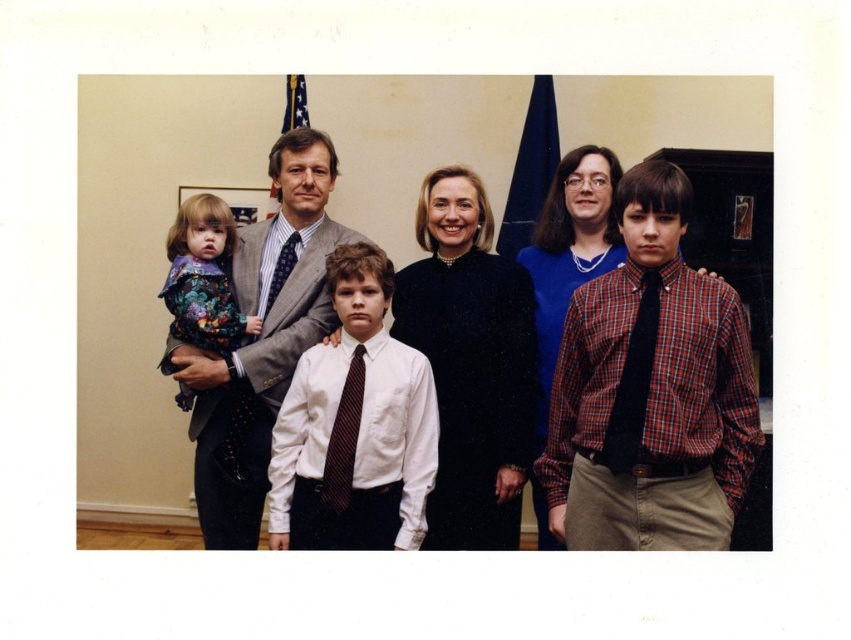
Does floral fabric dress at left have a lesser width compared to black silk tie at right?

In fact, floral fabric dress at left might be wider than black silk tie at right.

You are a GUI agent. You are given a task and a screenshot of the screen. Output one action in this format:
    pyautogui.click(x=<x>, y=<y>)
    Task: Click on the floral fabric dress at left
    The width and height of the screenshot is (851, 640).
    Given the screenshot: What is the action you would take?
    pyautogui.click(x=203, y=278)

What do you see at coordinates (203, 278) in the screenshot? This screenshot has width=851, height=640. I see `floral fabric dress at left` at bounding box center [203, 278].

Where is `floral fabric dress at left`? The width and height of the screenshot is (851, 640). floral fabric dress at left is located at coordinates (203, 278).

Does matte black dress at center have a lesser width compared to floral fabric dress at left?

No.

Is matte black dress at center below floral fabric dress at left?

Yes.

Who is more forward, (x=506, y=410) or (x=215, y=224)?

Point (x=506, y=410) is more forward.

Find the location of a particular element. The height and width of the screenshot is (640, 851). matte black dress at center is located at coordinates (260, 340).

Can you confirm if floral fabric dress at left is wider than polka dot silk tie at center?

Yes.

Is floral fabric dress at left taller than polka dot silk tie at center?

Yes.

Is point (210, 237) positioned in front of point (298, 234)?

Yes, it is.

Where is `floral fabric dress at left`? This screenshot has width=851, height=640. floral fabric dress at left is located at coordinates (203, 278).